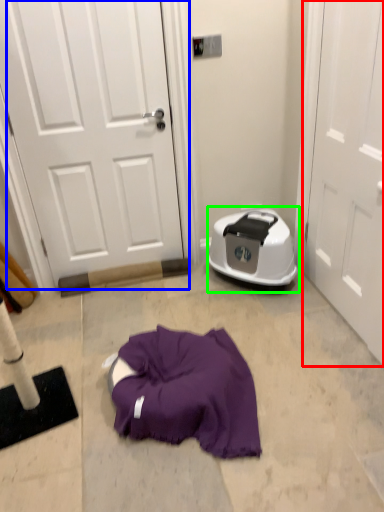
Question: Which is nearer to the door (highlighted by a red box)? door (highlighted by a blue box) or dish washer (highlighted by a green box).

Choices:
 (A) door
 (B) dish washer

Answer: (B)